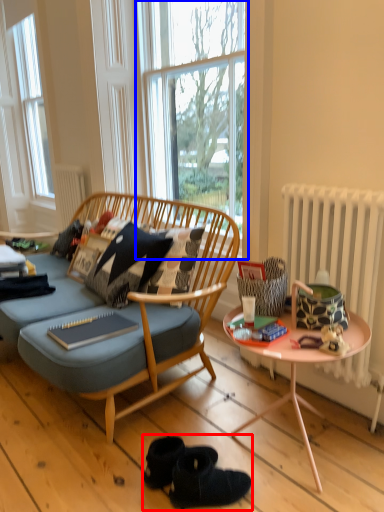
Question: Which of the following is the farthest to the observer, footwear (highlighted by a red box) or window (highlighted by a blue box)?

Choices:
 (A) footwear
 (B) window

Answer: (B)